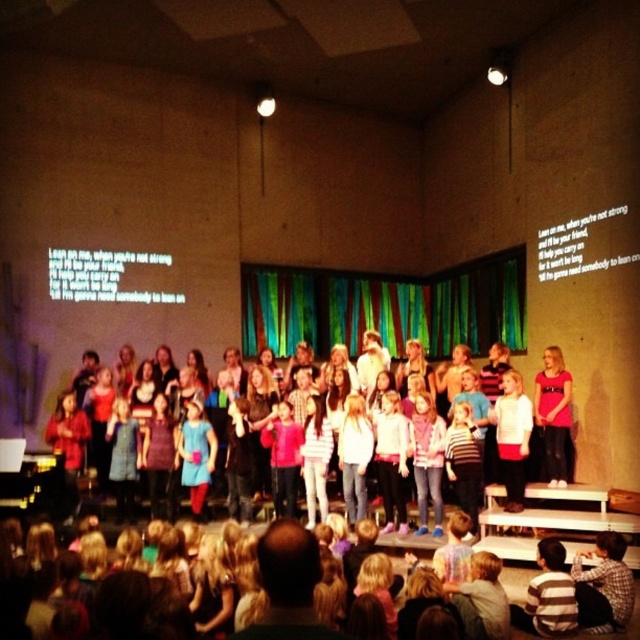
You are a photographer setting up for a school play. You notice two children wearing pink shirts on stage. The first child has a matte pink shirt at center, and the second has a pink matte shirt at center. Which child should you focus on to capture a wider portion of the shirt in your photo?

You should focus on the matte pink shirt at center because its width is larger than the pink matte shirt at center, allowing for a wider capture in the photo.

You are sitting in the audience of the performance hall and notice two points on the stage. The first point is at coordinates point [564,384] and the second at point [289,406]. Which point is closer to you?

Point [564,384] is closer to the viewer than point [289,406].

You are a photographer standing at the back of the auditorium and want to capture a closeup shot of the matte pink shirt at center. Based on its position, where should you aim your camera?

The matte pink shirt at center is located at point 0.652 on the horizontal axis and 0.867 on the vertical axis, so you should aim your camera towards the upper right area of the stage to capture it.